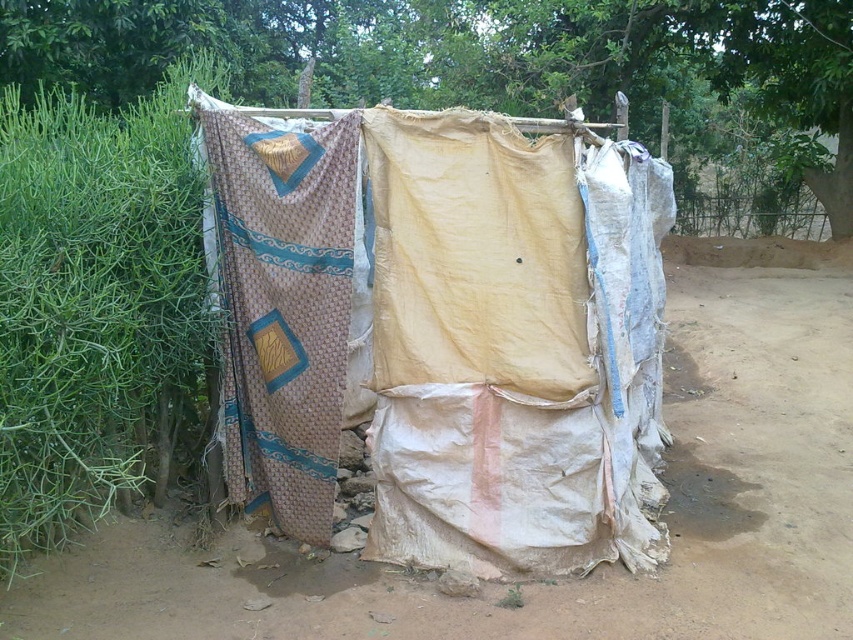
Is printed fabric cloth at center positioned before beige woven cloth at left?

Yes, it is in front of beige woven cloth at left.

Who is more distant from viewer, (485, 547) or (247, 372)?

Point (247, 372)

Which is behind, point (392, 317) or point (293, 256)?

Point (293, 256)

Where is `printed fabric cloth at center`? The height and width of the screenshot is (640, 853). printed fabric cloth at center is located at coordinates (445, 333).

Does brown dirt field at center appear under beige woven cloth at left?

Yes, brown dirt field at center is below beige woven cloth at left.

Between brown dirt field at center and beige woven cloth at left, which one appears on the right side from the viewer's perspective?

brown dirt field at center

Measure the distance between point (787, 264) and camera.

The distance of point (787, 264) from camera is 10.35 meters.

Image resolution: width=853 pixels, height=640 pixels. I want to click on brown dirt field at center, so click(x=596, y=566).

Who is more distant from viewer, [288,192] or [820,612]?

Positioned behind is point [288,192].

Who is positioned more to the right, printed fabric cloth at center or brown dirt field at center?

Positioned to the right is brown dirt field at center.

Find the location of `printed fabric cloth at center`. printed fabric cloth at center is located at coordinates (445, 333).